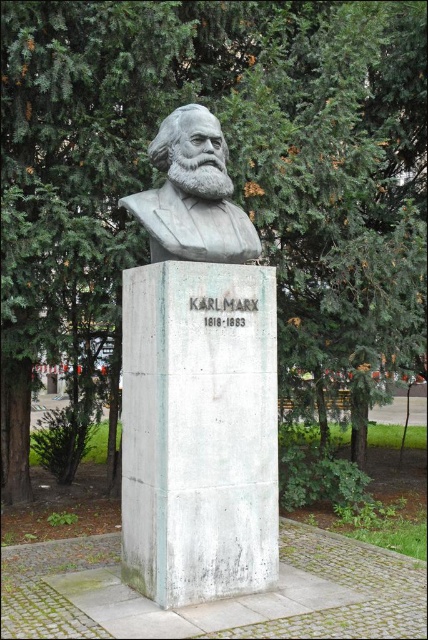
You are a GUI agent. You are given a task and a screenshot of the screen. Output one action in this format:
    pyautogui.click(x=<x>, y=<y>)
    Task: Click on the white marble bust at center
    The image size is (428, 640).
    Given the screenshot: What is the action you would take?
    pyautogui.click(x=198, y=381)

Is white marble bust at center shorter than gray polished bust at center?

Incorrect, white marble bust at center's height does not fall short of gray polished bust at center's.

Locate an element on the screen. white marble bust at center is located at coordinates (198, 381).

You are a GUI agent. You are given a task and a screenshot of the screen. Output one action in this format:
    pyautogui.click(x=<x>, y=<y>)
    Task: Click on the white marble bust at center
    The image size is (428, 640).
    Given the screenshot: What is the action you would take?
    pyautogui.click(x=198, y=381)